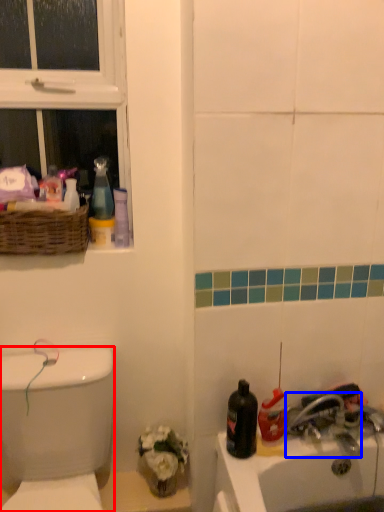
Question: Which point is further to the camera, porcelain (highlighted by a red box) or tap (highlighted by a blue box)?

Choices:
 (A) porcelain
 (B) tap

Answer: (B)